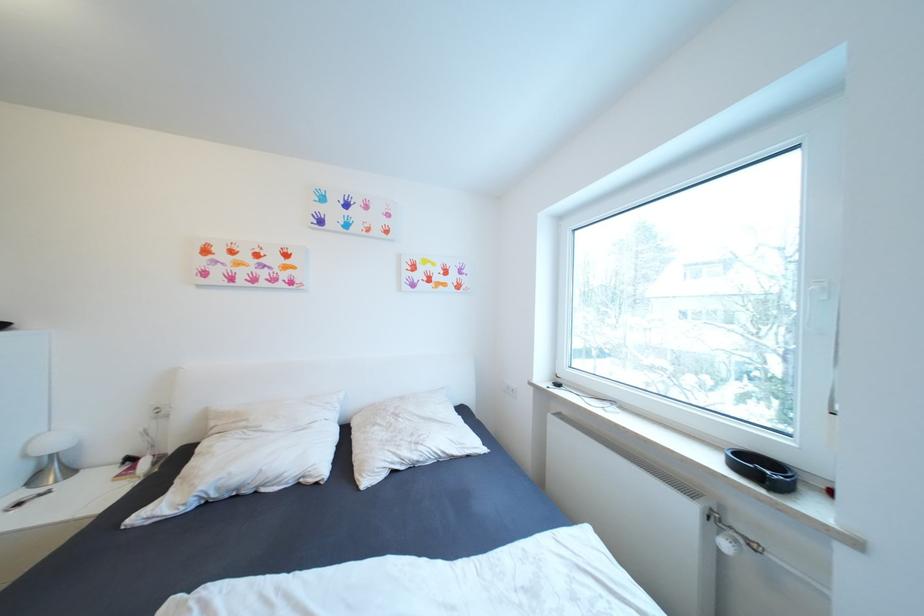
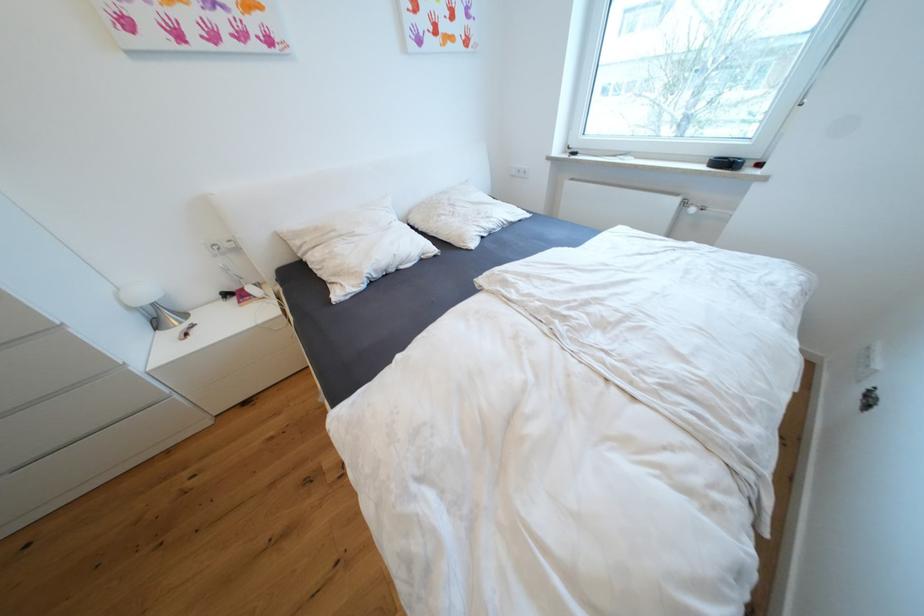
In the scene shown: The first image is from the beginning of the video and the second image is from the end. How did the camera likely rotate when shooting the video?

The camera's rotation is toward right-down.